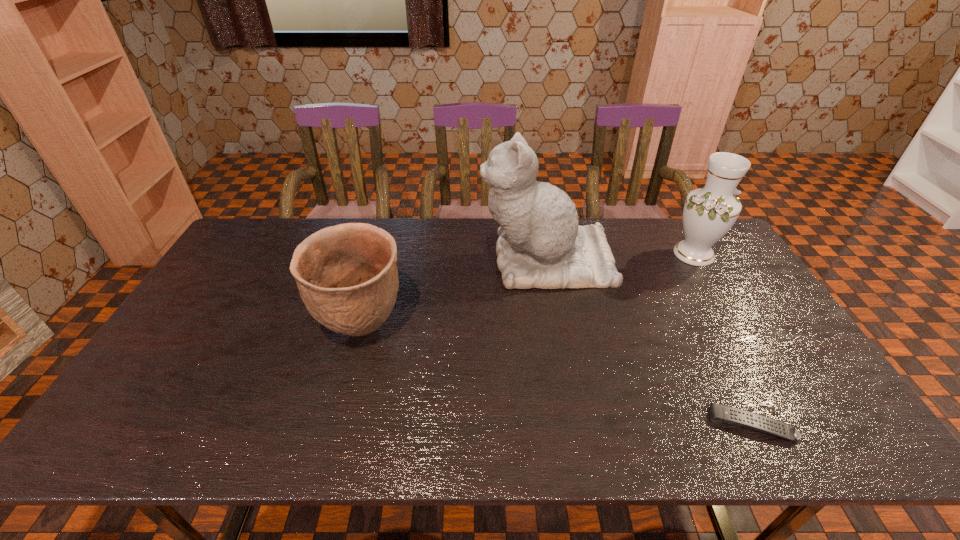
This screenshot has width=960, height=540. What are the coordinates of `the tallest object` in the screenshot? It's located at (541, 245).

Where is `cat`? The width and height of the screenshot is (960, 540). cat is located at coordinates (541, 245).

I want to click on the second tallest object, so click(x=709, y=212).

The height and width of the screenshot is (540, 960). I want to click on the second nearest object, so click(x=347, y=276).

Where is `pottery`? Image resolution: width=960 pixels, height=540 pixels. pottery is located at coordinates (347, 276).

Locate an element on the screen. remote control is located at coordinates (719, 413).

The width and height of the screenshot is (960, 540). In order to click on the shortest object in this screenshot , I will do `click(719, 413)`.

Find the location of `vacant space located 0.050m on the front-facing side of the tallest object`. vacant space located 0.050m on the front-facing side of the tallest object is located at coordinates (465, 260).

Where is `free space located 0.260m on the front-facing side of the tallest object`? This screenshot has height=540, width=960. free space located 0.260m on the front-facing side of the tallest object is located at coordinates (402, 260).

Find the location of a particular element. This screenshot has width=960, height=540. vacant space positioned 0.290m on the front-facing side of the tallest object is located at coordinates (393, 260).